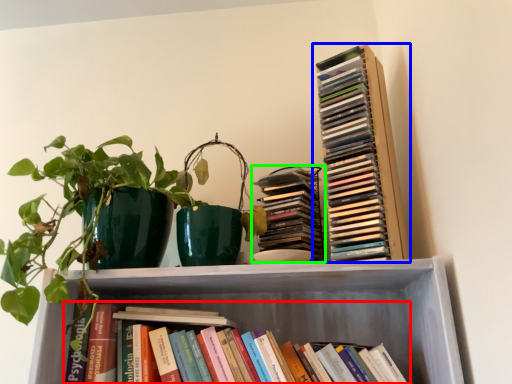
Question: Which object is the farthest from book (highlighted by a red box)? Choose among these: book (highlighted by a blue box) or book (highlighted by a green box).

Choices:
 (A) book
 (B) book

Answer: (A)